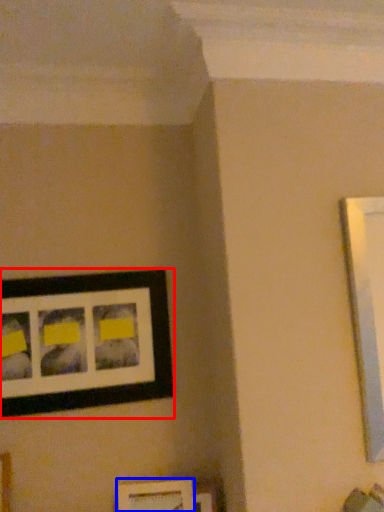
Question: Among these objects, which one is farthest to the camera, picture frame (highlighted by a red box) or picture frame (highlighted by a blue box)?

Choices:
 (A) picture frame
 (B) picture frame

Answer: (A)